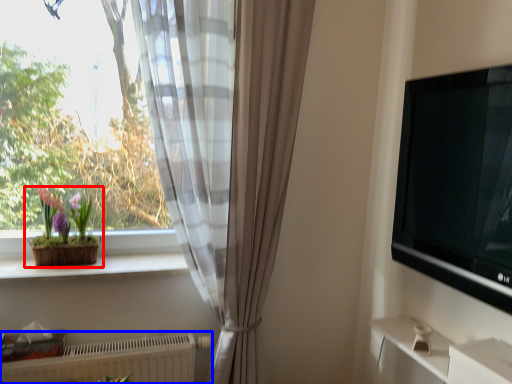
Question: Which of the following is the closest to the observer, houseplant (highlighted by a red box) or radiator (highlighted by a blue box)?

Choices:
 (A) houseplant
 (B) radiator

Answer: (B)